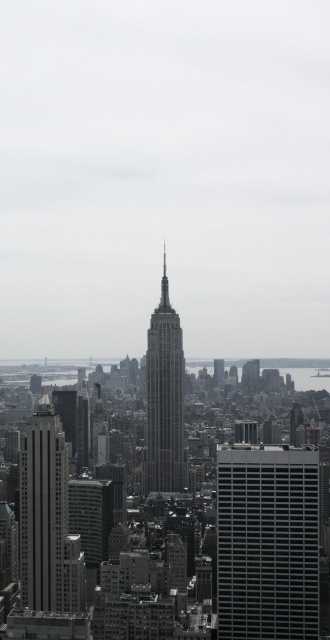
Does matte black building at center come in front of gray glass skyscraper at center?

That is False.

Is point (315, 480) more distant than point (149, 417)?

Yes.

Where is `matte black building at center`? This screenshot has width=330, height=640. matte black building at center is located at coordinates (266, 541).

Can you confirm if matte black building at center is taller than matte silver skyscraper at center-left?

Incorrect, matte black building at center's height is not larger of matte silver skyscraper at center-left's.

Can you confirm if matte black building at center is shorter than matte silver skyscraper at center-left?

Correct, matte black building at center is not as tall as matte silver skyscraper at center-left.

Where is `matte black building at center`? This screenshot has width=330, height=640. matte black building at center is located at coordinates [266, 541].

At what (x,y) coordinates should I click in order to perform the action: click on matte black building at center. Please return your answer as a coordinate pair (x, y). This screenshot has width=330, height=640. Looking at the image, I should click on (266, 541).

Does matte silver skyscraper at center-left come behind gray glass skyscraper at center?

Yes, it is behind gray glass skyscraper at center.

Is matte silver skyscraper at center-left to the left of gray glass skyscraper at center from the viewer's perspective?

Correct, you'll find matte silver skyscraper at center-left to the left of gray glass skyscraper at center.

Identify the location of matte silver skyscraper at center-left. (42, 509).